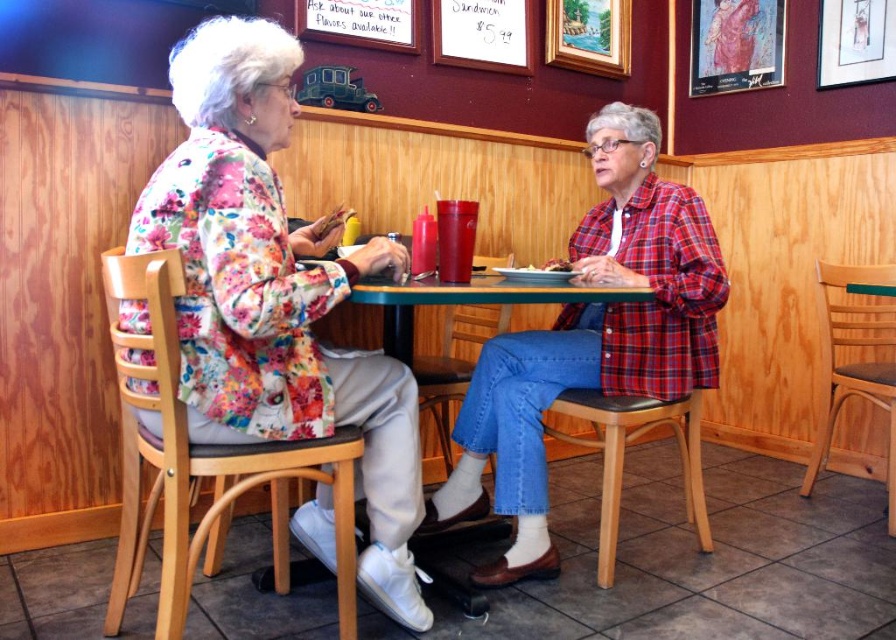
Question: Which point appears closest to the camera in this image?

Choices:
 (A) (548, 35)
 (B) (651, 419)
 (C) (510, 552)
 (D) (543, 269)

Answer: (D)

Question: Is plaid shirt at center in front of wooden picture frame at upper right?

Choices:
 (A) yes
 (B) no

Answer: (A)

Question: Does floral fabric jacket at upper left appear on the left side of wooden stool at lower center?

Choices:
 (A) yes
 (B) no

Answer: (A)

Question: Which point is closer to the camera?

Choices:
 (A) tap(601, 512)
 (B) tap(571, 266)
 (C) tap(475, 480)

Answer: (B)

Question: Does plaid shirt at center appear under white paper plate at center?

Choices:
 (A) no
 (B) yes

Answer: (B)

Question: Among these points, which one is farthest from the camera?

Choices:
 (A) (597, 172)
 (B) (593, 51)

Answer: (B)